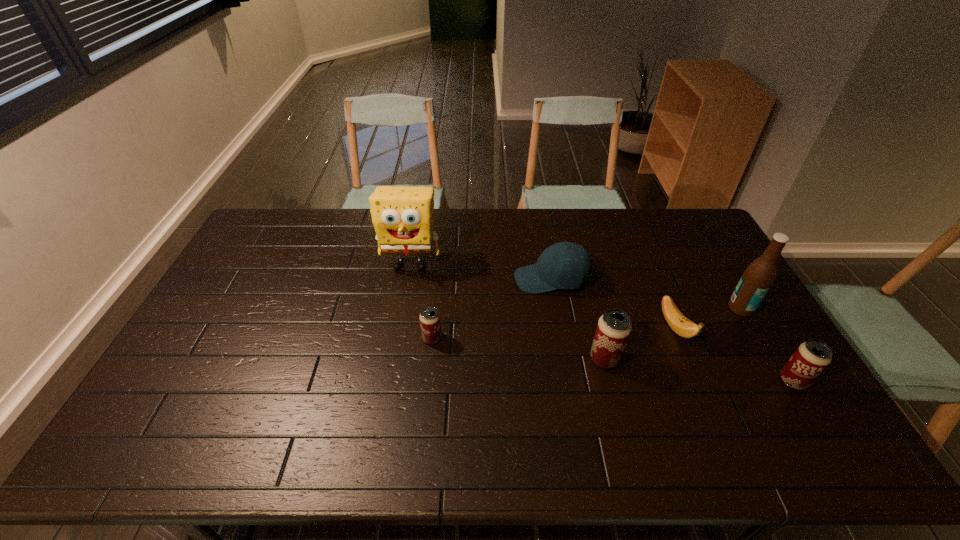
Find the location of a particular element. vacant space situated 0.340m on the left of the rightmost beer can is located at coordinates (653, 381).

Locate an element on the screen. Image resolution: width=960 pixels, height=540 pixels. vacant area situated on the front of the beer bottle is located at coordinates (762, 343).

This screenshot has width=960, height=540. I want to click on vacant space located 0.050m on the front-facing side of the baseball cap, so click(x=499, y=280).

Identify the location of vacant region located on the front-facing side of the baseball cap. coord(418,280).

At what (x,y) coordinates should I click in order to perform the action: click on free spot located 0.210m on the front-facing side of the baseball cap. Please return your answer as a coordinate pair (x, y). This screenshot has width=960, height=540. Looking at the image, I should click on (451, 280).

This screenshot has width=960, height=540. I want to click on free point located 0.050m on the face of the sponge, so click(x=406, y=289).

Find the location of a particular element. vacant space located on the back of the banana is located at coordinates (650, 265).

Locate an element on the screen. The width and height of the screenshot is (960, 540). object that is positioned at the near edge is located at coordinates (811, 358).

This screenshot has height=540, width=960. I want to click on beer can that is positioned at the right edge, so click(811, 358).

Where is `beer bottle at the right edge`? The height and width of the screenshot is (540, 960). beer bottle at the right edge is located at coordinates (756, 281).